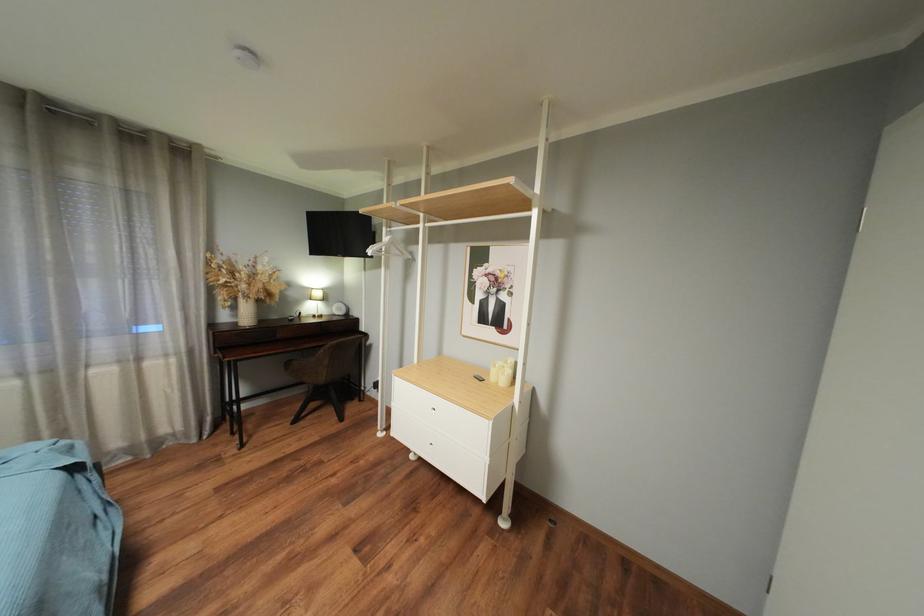
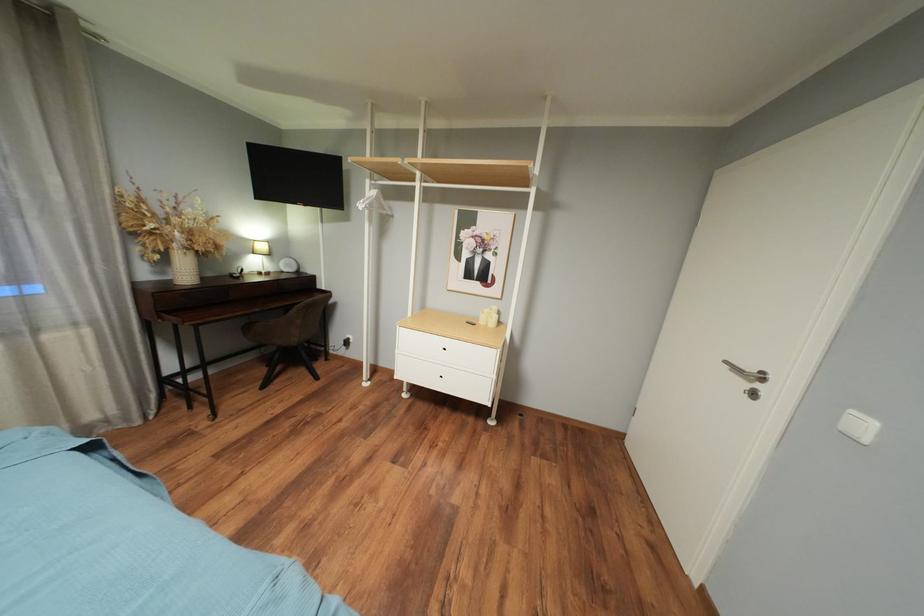
Question: The camera is either moving clockwise (left) or counter-clockwise (right) around the object. The first image is from the beginning of the video and the second image is from the end. Is the camera moving left or right when shooting the video?

Choices:
 (A) Left
 (B) Right

Answer: (A)